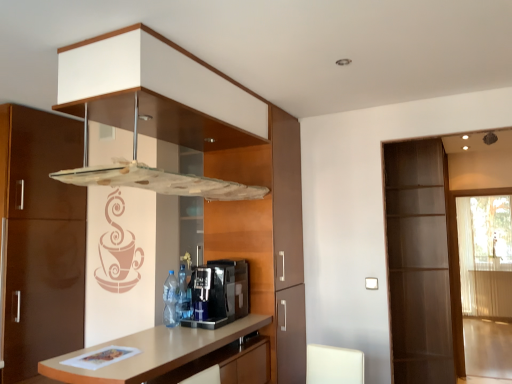
This screenshot has height=384, width=512. Describe the element at coordinates (482, 284) in the screenshot. I see `translucent white screen door at right, acting as the first screen door starting from the right` at that location.

How much space does blue plastic bottle at center, which appears as the second bottle when viewed from the front, occupy horizontally?

It is 3.27 inches.

Describe the element at coordinates (218, 294) in the screenshot. The image size is (512, 384). I see `black plastic coffee machine at center` at that location.

This screenshot has width=512, height=384. I want to click on translucent white screen door at right, acting as the first screen door starting from the right, so click(x=482, y=284).

Is transparent glass exhaust hood at upper center inside the boundaries of translucent white screen door at right, acting as the first screen door starting from the right, or outside?

transparent glass exhaust hood at upper center is spatially situated outside translucent white screen door at right, acting as the first screen door starting from the right.

Is point (164, 189) closer or farther from the camera than point (455, 341)?

Point (164, 189) appears to be closer to the viewer than point (455, 341).

Which is in front, transparent glass exhaust hood at upper center or translucent white screen door at right, acting as the first screen door starting from the right?

transparent glass exhaust hood at upper center is in front.

Who is taller, transparent glass exhaust hood at upper center or translucent white screen door at right, acting as the first screen door starting from the right?

translucent white screen door at right, acting as the first screen door starting from the right.

Is blue plastic bottle at center, arranged as the 1th bottle when viewed from the back, a part of blue plastic bottle at center, which is the second bottle from back to front?

No, blue plastic bottle at center, arranged as the 1th bottle when viewed from the back, is not surrounded by blue plastic bottle at center, which is the second bottle from back to front.

Identify the location of bottle positioned vertically above the blue plastic bottle at center, which is the second bottle from back to front (from a real-world perspective). (183, 294).

Does blue plastic bottle at center, the first bottle from the front, have a lesser width compared to blue plastic bottle at center, which appears as the second bottle when viewed from the front?

No, blue plastic bottle at center, the first bottle from the front, is not thinner than blue plastic bottle at center, which appears as the second bottle when viewed from the front.

Is blue plastic bottle at center, the first bottle from the front, oriented away from blue plastic bottle at center, which appears as the second bottle when viewed from the front?

Yes, blue plastic bottle at center, the first bottle from the front, is positioned with its back facing blue plastic bottle at center, which appears as the second bottle when viewed from the front.

Which object is positioned more to the right, light brown wood countertop at center or blue plastic bottle at center, the first bottle from the front?

light brown wood countertop at center.

Who is more distant, light brown wood countertop at center or blue plastic bottle at center, the first bottle from the front?

blue plastic bottle at center, the first bottle from the front, is behind.

From the image's perspective, is light brown wood countertop at center above blue plastic bottle at center, which is the second bottle from back to front?

Incorrect, from the image's perspective, light brown wood countertop at center is lower than blue plastic bottle at center, which is the second bottle from back to front.

Is light brown wood countertop at center oriented away from blue plastic bottle at center, which is the second bottle from back to front?

No, blue plastic bottle at center, which is the second bottle from back to front, is not at the back of light brown wood countertop at center.

Would you consider black plastic coffee machine at center to be distant from transparent glass screen door at right, marked as the 2th screen door in a right-to-left arrangement?

Absolutely, black plastic coffee machine at center is distant from transparent glass screen door at right, marked as the 2th screen door in a right-to-left arrangement.

Would you say transparent glass screen door at right, marked as the 2th screen door in a right-to-left arrangement, is part of black plastic coffee machine at center's contents?

No, transparent glass screen door at right, marked as the 2th screen door in a right-to-left arrangement, is not a part of black plastic coffee machine at center.

From a real-world perspective, is black plastic coffee machine at center over transparent glass screen door at right, which ranks as the 1th screen door in left-to-right order?

Correct, in the physical world, black plastic coffee machine at center is higher than transparent glass screen door at right, which ranks as the 1th screen door in left-to-right order.

Considering the sizes of black plastic coffee machine at center and transparent glass screen door at right, marked as the 2th screen door in a right-to-left arrangement, in the image, is black plastic coffee machine at center wider or thinner than transparent glass screen door at right, marked as the 2th screen door in a right-to-left arrangement,?

Clearly, black plastic coffee machine at center has less width compared to transparent glass screen door at right, marked as the 2th screen door in a right-to-left arrangement.

Could you measure the distance between light brown wood countertop at center and black plastic coffee machine at center?

light brown wood countertop at center and black plastic coffee machine at center are 10.45 inches apart.

Can you confirm if light brown wood countertop at center is taller than black plastic coffee machine at center?

Yes.

Is light brown wood countertop at center positioned before black plastic coffee machine at center?

Yes, it is in front of black plastic coffee machine at center.

Is light brown wood countertop at center smaller than black plastic coffee machine at center?

No.

Is point (76, 183) closer to viewer compared to point (140, 335)?

Yes, point (76, 183) is in front of point (140, 335).

Is transparent glass exhaust hood at upper center oriented towards light brown wood countertop at center?

No.

From a real-world perspective, is transparent glass exhaust hood at upper center beneath light brown wood countertop at center?

No.

Between transparent glass screen door at right, marked as the 2th screen door in a right-to-left arrangement, and light brown wood countertop at center, which one has larger size?

transparent glass screen door at right, marked as the 2th screen door in a right-to-left arrangement, is bigger.

Can you confirm if transparent glass screen door at right, which ranks as the 1th screen door in left-to-right order, is taller than light brown wood countertop at center?

Indeed, transparent glass screen door at right, which ranks as the 1th screen door in left-to-right order, has a greater height compared to light brown wood countertop at center.

Which point is more distant from viewer, (417, 311) or (155, 331)?

The point (417, 311) is farther from the camera.

From a real-world perspective, relative to light brown wood countertop at center, is transparent glass screen door at right, marked as the 2th screen door in a right-to-left arrangement, vertically above or below?

transparent glass screen door at right, marked as the 2th screen door in a right-to-left arrangement, is above light brown wood countertop at center.

At what (x,y) coordinates should I click in order to perform the action: click on exhaust hood that appears above the translucent white screen door at right, acting as the first screen door starting from the right (from a real-world perspective). Please return your answer as a coordinate pair (x, y). Image resolution: width=512 pixels, height=384 pixels. Looking at the image, I should click on (155, 176).

Image resolution: width=512 pixels, height=384 pixels. What are the coordinates of `bottle on the right of blue plastic bottle at center, the first bottle from the front` in the screenshot? It's located at (183, 294).

Which object lies nearer to the anchor point transparent glass screen door at right, marked as the 2th screen door in a right-to-left arrangement, transparent glass exhaust hood at upper center or blue plastic bottle at center, which appears as the second bottle when viewed from the front?

Among the two, transparent glass exhaust hood at upper center is located nearer to transparent glass screen door at right, marked as the 2th screen door in a right-to-left arrangement.

Based on their spatial positions, is transparent glass screen door at right, which ranks as the 1th screen door in left-to-right order, or light brown wood countertop at center closer to blue plastic bottle at center, arranged as the 1th bottle when viewed from the back?

light brown wood countertop at center lies closer to blue plastic bottle at center, arranged as the 1th bottle when viewed from the back, than the other object.

From the image, which object appears to be farther from light brown wood countertop at center, translucent white screen door at right, acting as the first screen door starting from the right, or blue plastic bottle at center, the first bottle from the front?

translucent white screen door at right, acting as the first screen door starting from the right, lies further to light brown wood countertop at center than the other object.

From the image, which object appears to be nearer to blue plastic bottle at center, arranged as the 1th bottle when viewed from the back, black plastic coffee machine at center or transparent glass exhaust hood at upper center?

Among the two, black plastic coffee machine at center is located nearer to blue plastic bottle at center, arranged as the 1th bottle when viewed from the back.

When comparing their distances from transparent glass screen door at right, marked as the 2th screen door in a right-to-left arrangement, does light brown wood countertop at center or translucent white screen door at right, the 2th screen door from the left, seem further?

The object further to transparent glass screen door at right, marked as the 2th screen door in a right-to-left arrangement, is light brown wood countertop at center.

From the image, which object appears to be nearer to light brown wood countertop at center, blue plastic bottle at center, arranged as the 1th bottle when viewed from the back, or black plastic coffee machine at center?

Among the two, black plastic coffee machine at center is located nearer to light brown wood countertop at center.

When comparing their distances from transparent glass exhaust hood at upper center, does blue plastic bottle at center, the first bottle from the front, or black plastic coffee machine at center seem closer?

black plastic coffee machine at center is positioned closer to the anchor transparent glass exhaust hood at upper center.

Considering their positions, is blue plastic bottle at center, the first bottle from the front, positioned closer to blue plastic bottle at center, arranged as the 1th bottle when viewed from the back, than transparent glass exhaust hood at upper center?

blue plastic bottle at center, the first bottle from the front, lies closer to blue plastic bottle at center, arranged as the 1th bottle when viewed from the back, than the other object.

Locate an element on the screen. The image size is (512, 384). coffee machine positioned between light brown wood countertop at center and blue plastic bottle at center, which is the second bottle from back to front, from near to far is located at coordinates (218, 294).

At what (x,y) coordinates should I click in order to perform the action: click on coffee machine that lies between transparent glass exhaust hood at upper center and blue plastic bottle at center, which appears as the second bottle when viewed from the front, from top to bottom. Please return your answer as a coordinate pair (x, y). Looking at the image, I should click on (218, 294).

This screenshot has width=512, height=384. Find the location of `bottle positioned between black plastic coffee machine at center and blue plastic bottle at center, which appears as the second bottle when viewed from the front, from near to far`. bottle positioned between black plastic coffee machine at center and blue plastic bottle at center, which appears as the second bottle when viewed from the front, from near to far is located at coordinates (170, 300).

You are a GUI agent. You are given a task and a screenshot of the screen. Output one action in this format:
    pyautogui.click(x=<x>, y=<y>)
    Task: Click on the exhaust hood situated between blue plastic bottle at center, which is the second bottle from back to front, and translucent white screen door at right, acting as the first screen door starting from the right, from left to right
    
    Given the screenshot: What is the action you would take?
    pyautogui.click(x=155, y=176)